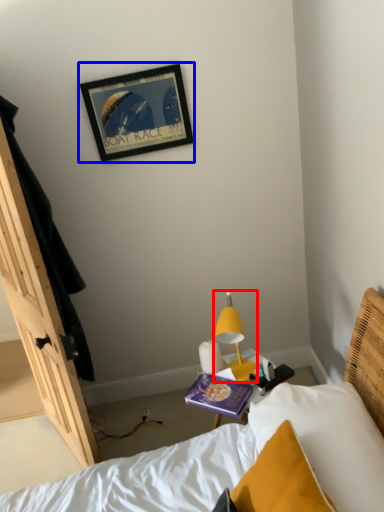
Question: Which object is further to the camera taking this photo, lamp (highlighted by a red box) or picture frame (highlighted by a blue box)?

Choices:
 (A) lamp
 (B) picture frame

Answer: (B)